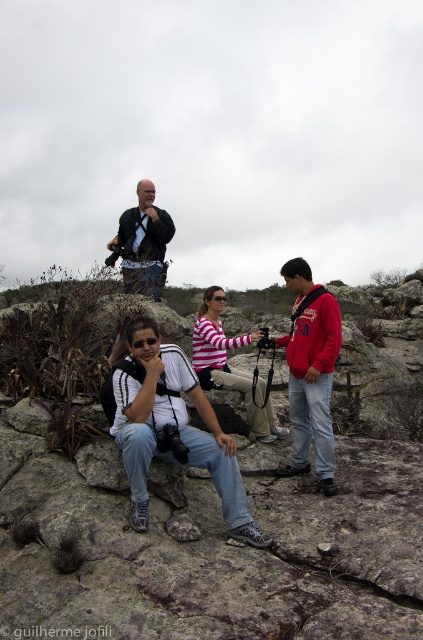
Question: Can you confirm if striped cotton shirt at center is positioned to the right of black leather jacket at center?

Choices:
 (A) no
 (B) yes

Answer: (B)

Question: Can you confirm if rough stone rock at center is positioned to the left of black leather jacket at center?

Choices:
 (A) no
 (B) yes

Answer: (A)

Question: Which of the following is the closest to the observer?

Choices:
 (A) (140, 593)
 (B) (320, 461)
 (C) (214, 428)

Answer: (A)

Question: Which object appears farthest from the camera in this image?

Choices:
 (A) black leather jacket at center
 (B) striped cotton shirt at center

Answer: (A)

Question: Is red fleece jacket at center behind black leather jacket at center?

Choices:
 (A) no
 (B) yes

Answer: (A)

Question: Considering the real-world distances, which object is closest to the rough stone rock at center?

Choices:
 (A) black leather jacket at center
 (B) striped cotton shirt at center
 (C) red fleece jacket at center
 (D) white matte shirt at center

Answer: (D)